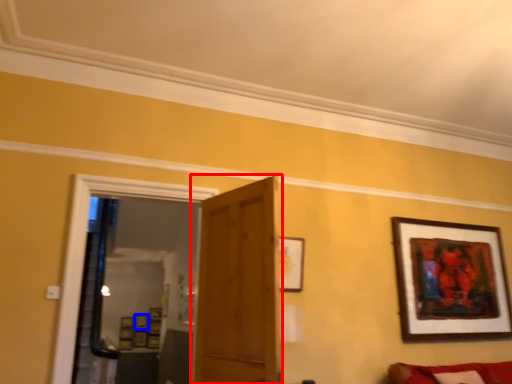
Question: Which point is further to the camera, door (highlighted by a red box) or picture frame (highlighted by a blue box)?

Choices:
 (A) door
 (B) picture frame

Answer: (B)